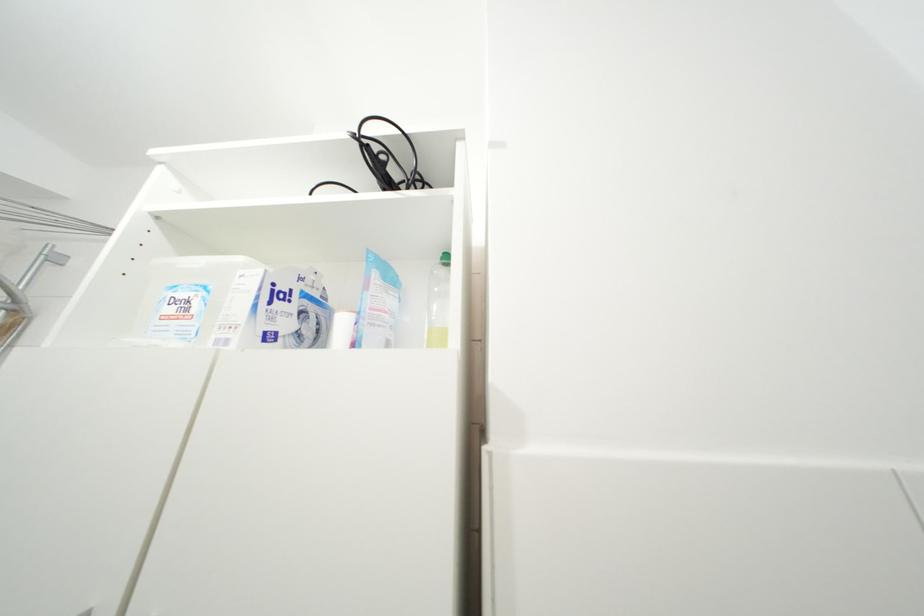
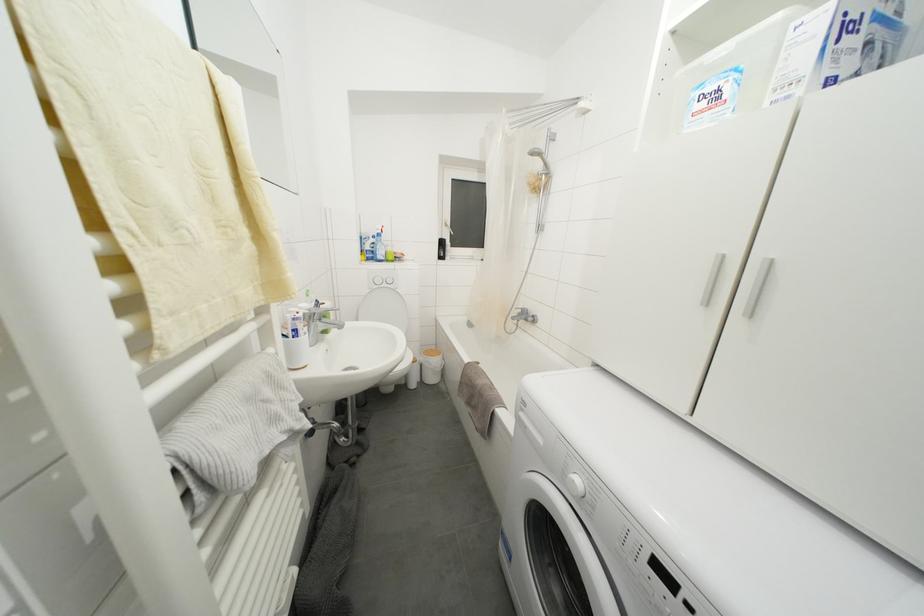
First-person continuous shooting, in which direction is the camera rotating?

The camera's rotation is toward left-down.